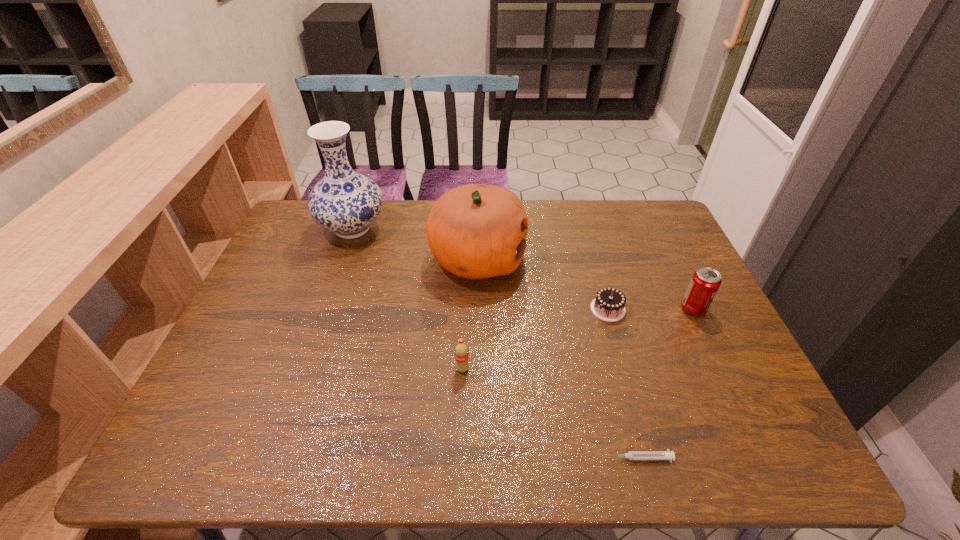
Where is `blank area located on the right of the tallest object`? The image size is (960, 540). blank area located on the right of the tallest object is located at coordinates (461, 229).

Locate an element on the screen. The image size is (960, 540). vacant region located 0.060m on the face of the pumpkin is located at coordinates (545, 259).

Image resolution: width=960 pixels, height=540 pixels. What are the coordinates of `vacant region located on the back of the farther soda` in the screenshot? It's located at (668, 258).

Where is `free space located 0.250m on the back of the nearer soda`? free space located 0.250m on the back of the nearer soda is located at coordinates (466, 290).

This screenshot has height=540, width=960. What are the coordinates of `free region located 0.090m on the back of the second shortest object` in the screenshot? It's located at (598, 275).

This screenshot has width=960, height=540. In order to click on vacant space located 0.390m at the needle end of the nearest object in this screenshot , I will do `click(412, 458)`.

This screenshot has height=540, width=960. I want to click on vacant space located 0.340m at the needle end of the nearest object, so click(437, 458).

Locate an element on the screen. vacant space located 0.320m at the needle end of the nearest object is located at coordinates (446, 458).

The height and width of the screenshot is (540, 960). I want to click on vase present at the far edge, so click(x=345, y=202).

Where is `pumpkin that is at the far edge`? The height and width of the screenshot is (540, 960). pumpkin that is at the far edge is located at coordinates [x=476, y=231].